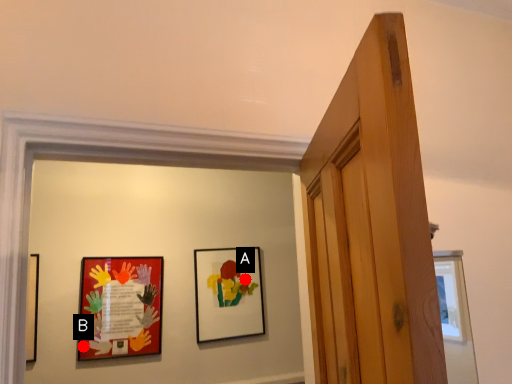
Question: Two points are circled on the image, labeled by A and B beside each circle. Which point appears farthest from the camera in this image?

Choices:
 (A) A is further
 (B) B is further

Answer: (A)